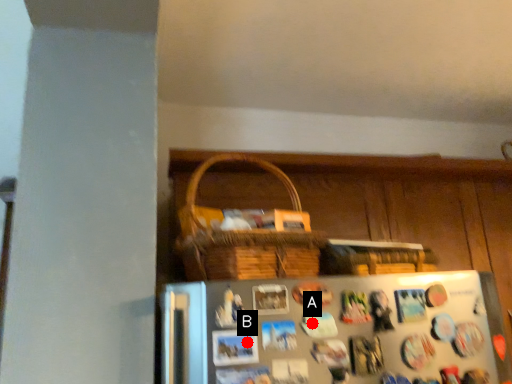
Question: Two points are circled on the image, labeled by A and B beside each circle. Which point is further to the camera?

Choices:
 (A) A is further
 (B) B is further

Answer: (A)